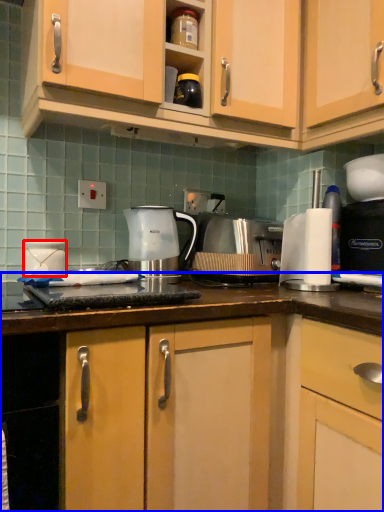
Question: Which point is closer to the camera, appliance (highlighted by a red box) or countertop (highlighted by a blue box)?

Choices:
 (A) appliance
 (B) countertop

Answer: (B)